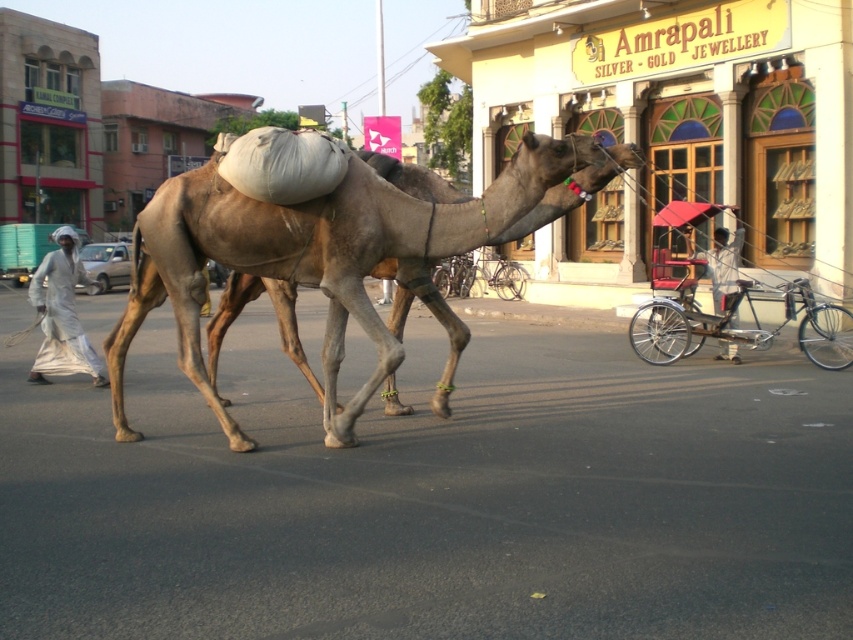
You are a tourist standing on the street and want to take a photo of the metallic silver rickshaw at right and the white cotton clothing at left. Which object should you focus on first if you want to capture both in the same frame without moving your camera?

The metallic silver rickshaw at right is taller than the white cotton clothing at left, so you should focus on the metallic silver rickshaw at right first to ensure both are in the frame.

You are standing at the origin point of the coordinate system in the image. The brown matte camel at center is located at coordinates 0.403, 0.395. If you want to walk directly towards the camel, in which direction should you move?

Since the brown matte camel at center is located at coordinates approximately 0.403 on the x and y axes, you should move northeast to reach it.

You are a delivery person who needs to transport a package from the metallic silver rickshaw at right to the brown matte camel at center. Considering their sizes, which vehicle can carry a larger item?

The brown matte camel at center can carry a larger item because its width surpasses that of the metallic silver rickshaw at right.